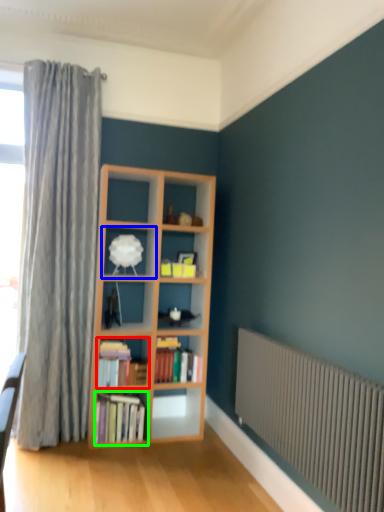
Question: Which is farther away from book (highlighted by a red box)? shelf (highlighted by a blue box) or book (highlighted by a green box)?

Choices:
 (A) shelf
 (B) book

Answer: (A)